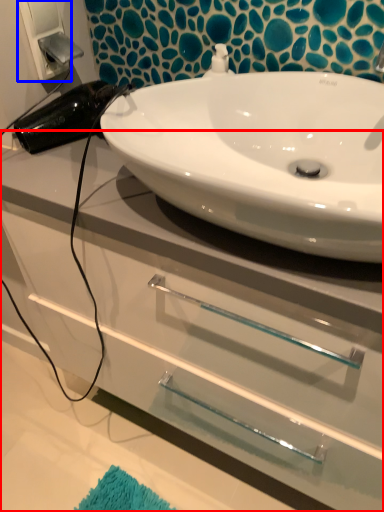
Question: Which of the following is the closest to the observer, bathroom cabinet (highlighted by a red box) or electric outlet (highlighted by a blue box)?

Choices:
 (A) bathroom cabinet
 (B) electric outlet

Answer: (A)